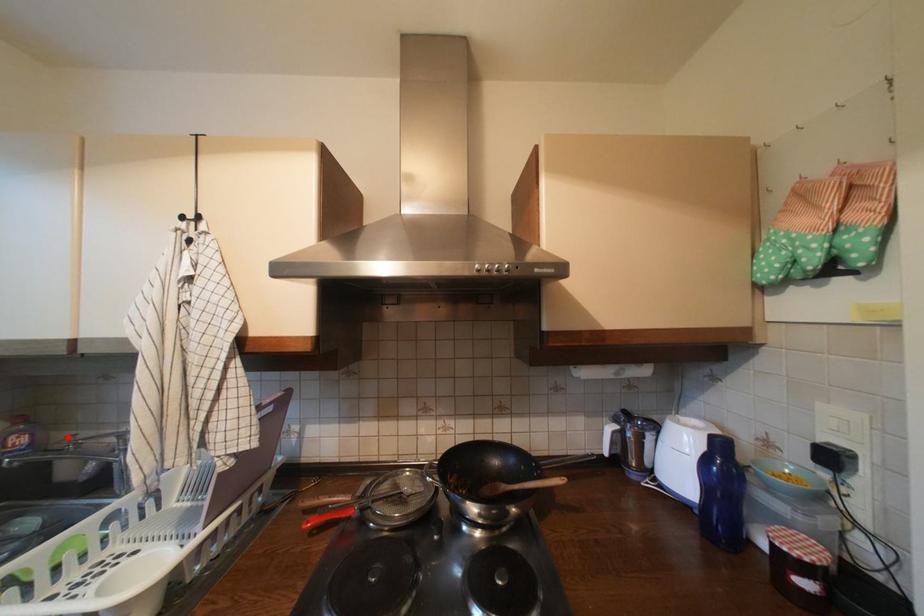
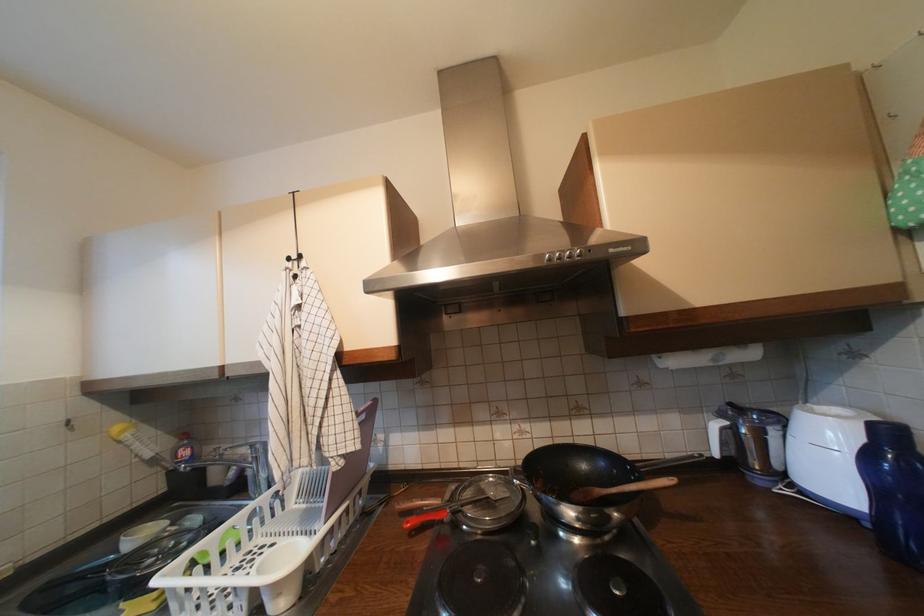
The point at the highlighted location is marked in the first image. Where is the corresponding point in the second image?

(217, 450)